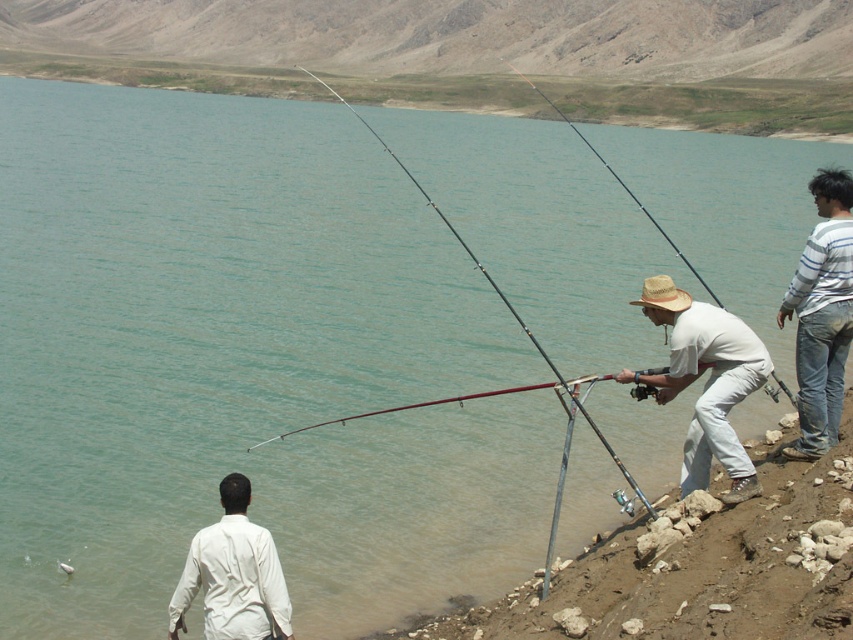
You are a photographer trying to capture the metallic fishing rod at lower right and the metallic rod at center in the same frame. Which rod is closer to the camera?

The metallic fishing rod at lower right is positioned under the metallic rod at center, so it is closer to the camera.

You are standing at the point labeled as point (822, 314) in the image. Looking around, you see a striped shirt at right. Which direction should you face to see the striped shirt at right?

A: You should face to the right to see the striped shirt at right as the point (822, 314) is located at the right side of the image.